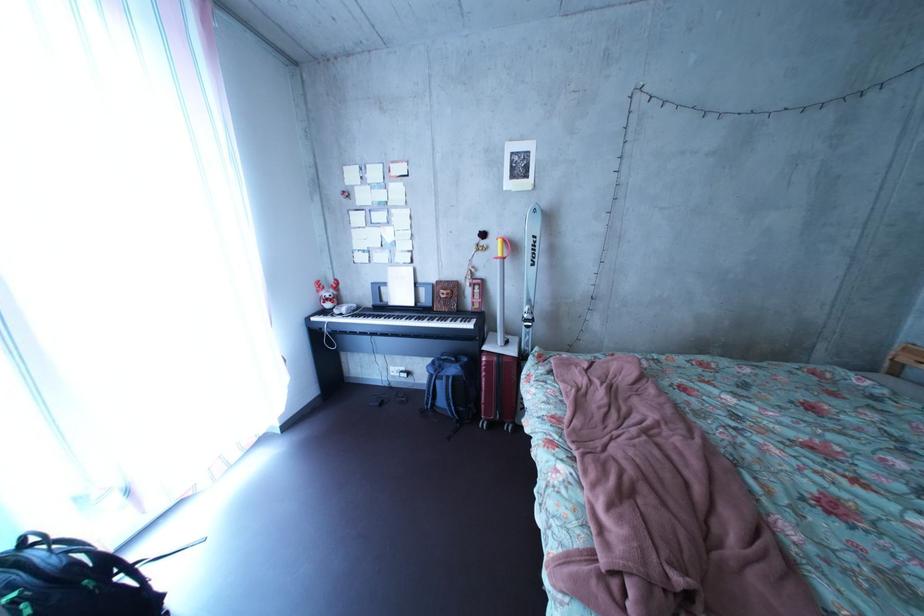
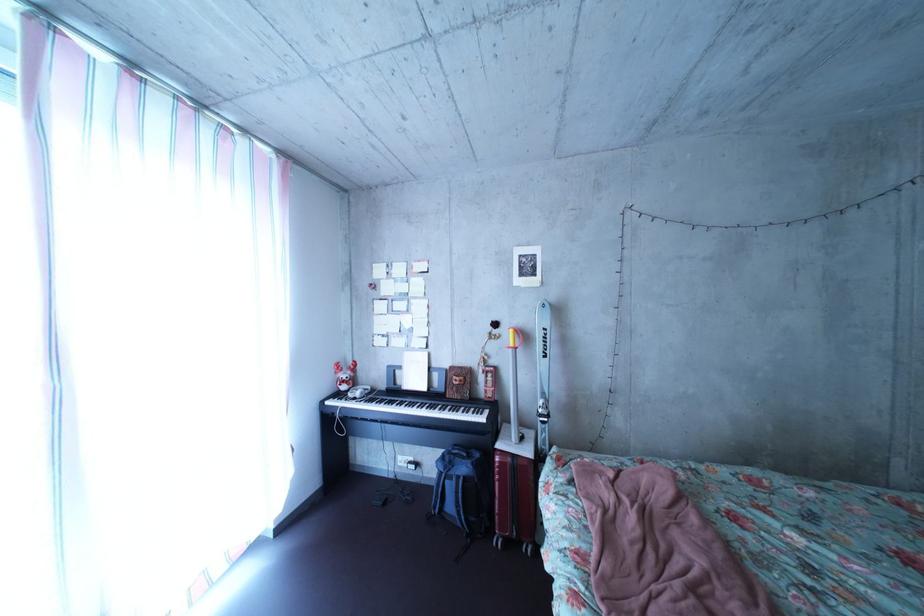
The point at (497, 251) is marked in the first image. Where is the corresponding point in the second image?

(509, 339)